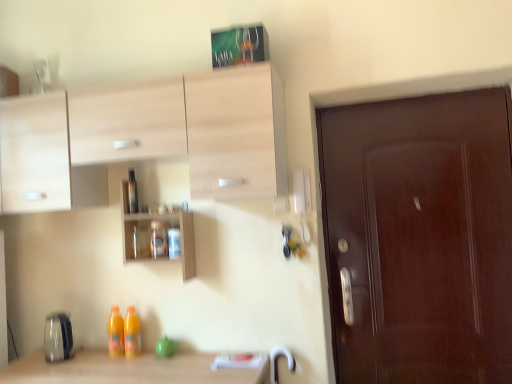
Question: Can you confirm if wooden shelves at center is smaller than translucent glass jar at center, placed as the second bottle when sorted from top to bottom?

Choices:
 (A) no
 (B) yes

Answer: (A)

Question: Are wooden shelves at center and translucent glass jar at center, which ranks as the second bottle in left-to-right order, far apart?

Choices:
 (A) no
 (B) yes

Answer: (A)

Question: Is wooden shelves at center at the right side of translucent glass jar at center, the first bottle in the right-to-left sequence?

Choices:
 (A) yes
 (B) no

Answer: (B)

Question: Is translucent glass jar at center, which ranks as the second bottle in left-to-right order, at the back of wooden shelves at center?

Choices:
 (A) no
 (B) yes

Answer: (B)

Question: Considering the relative positions of wooden shelves at center and translucent glass jar at center, placed as the second bottle when sorted from top to bottom, in the image provided, is wooden shelves at center to the left of translucent glass jar at center, placed as the second bottle when sorted from top to bottom, from the viewer's perspective?

Choices:
 (A) no
 (B) yes

Answer: (B)

Question: Is wooden shelves at center taller than translucent glass jar at center, which ranks as the second bottle in left-to-right order?

Choices:
 (A) no
 (B) yes

Answer: (B)

Question: Does transparent plastic bottle at center, the second bottle ordered from the bottom, have a larger size compared to wooden shelves at center?

Choices:
 (A) no
 (B) yes

Answer: (A)

Question: Is transparent plastic bottle at center, the second bottle positioned from the right, closer to the viewer compared to wooden shelves at center?

Choices:
 (A) yes
 (B) no

Answer: (B)

Question: From the image's perspective, would you say transparent plastic bottle at center, positioned as the 1th bottle in top-to-bottom order, is positioned over wooden shelves at center?

Choices:
 (A) yes
 (B) no

Answer: (A)

Question: Can you confirm if transparent plastic bottle at center, positioned as the 1th bottle in top-to-bottom order, is wider than wooden shelves at center?

Choices:
 (A) yes
 (B) no

Answer: (B)

Question: Is transparent plastic bottle at center, the second bottle ordered from the bottom, oriented away from wooden shelves at center?

Choices:
 (A) no
 (B) yes

Answer: (B)

Question: Can you confirm if transparent plastic bottle at center, positioned as the 1th bottle in top-to-bottom order, is shorter than wooden shelves at center?

Choices:
 (A) no
 (B) yes

Answer: (B)

Question: Considering the relative sizes of translucent glass jar at center, placed as the second bottle when sorted from top to bottom, and transparent plastic bottle at center, the 1th bottle in the left-to-right sequence, in the image provided, is translucent glass jar at center, placed as the second bottle when sorted from top to bottom, smaller than transparent plastic bottle at center, the 1th bottle in the left-to-right sequence,?

Choices:
 (A) no
 (B) yes

Answer: (A)